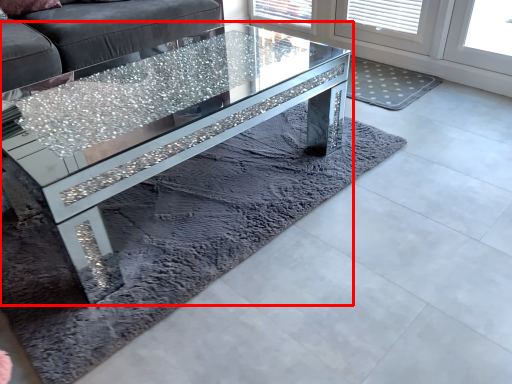
Question: Where is coffee table (annotated by the red box) located in relation to glass table in the image?

Choices:
 (A) left
 (B) right

Answer: (B)